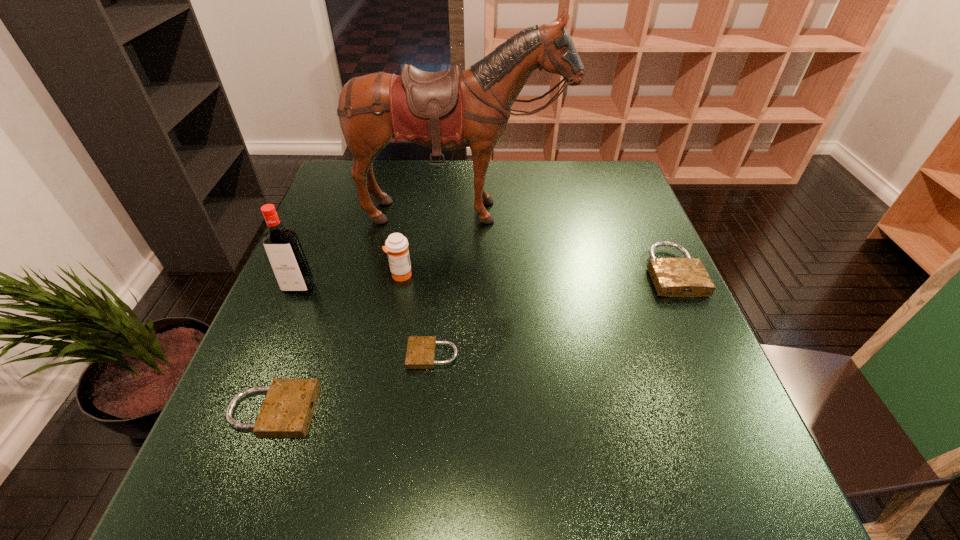
Locate an element on the screen. Image resolution: width=960 pixels, height=540 pixels. vacant space at the far left corner of the desktop is located at coordinates (323, 200).

Identify the location of free location at the far right corner. (595, 177).

The width and height of the screenshot is (960, 540). In order to click on free spot between the third tallest object and the fifth shortest object in this screenshot , I will do `click(349, 281)`.

Where is `vacant space in between the second nearest object and the nearest padlock`? vacant space in between the second nearest object and the nearest padlock is located at coordinates (352, 383).

Find the location of a particular element. The width and height of the screenshot is (960, 540). blank region between the medicine and the vodka is located at coordinates (349, 281).

Locate an element on the screen. empty location between the rightmost padlock and the second nearest padlock is located at coordinates (553, 313).

What are the coordinates of `free space between the fourth shortest object and the leftmost padlock` in the screenshot? It's located at (337, 343).

The height and width of the screenshot is (540, 960). I want to click on free space between the second tallest object and the farthest padlock, so (486, 280).

You are a GUI agent. You are given a task and a screenshot of the screen. Output one action in this format:
    pyautogui.click(x=<x>, y=<y>)
    Task: Click on the blank region between the shortest object and the rightmost padlock
    This screenshot has width=960, height=540.
    Given the screenshot: What is the action you would take?
    pyautogui.click(x=553, y=313)

This screenshot has height=540, width=960. Find the location of `empty location between the second tallest object and the third tallest object`. empty location between the second tallest object and the third tallest object is located at coordinates (349, 281).